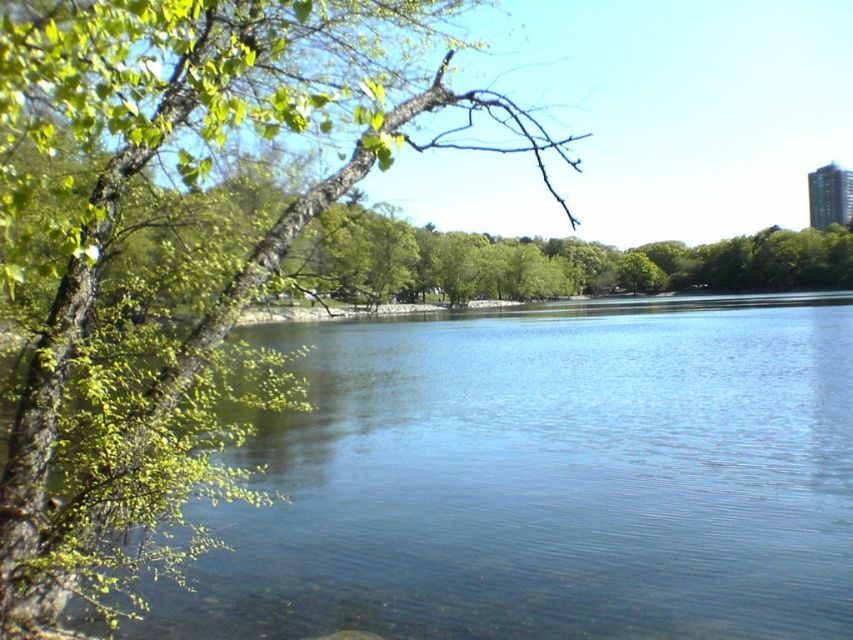
You are an artist wanting to paint the scene. You notice the clear blue water at left and the green leafy branch at left. Which one takes up more space in the image?

The green leafy branch at left takes up more space in the image because it is larger than the clear blue water at left.

You are standing at the edge of the scene and want to throw a stone into the clear blue water at left. To ensure the stone lands in the water and not on the green leafy branch at left, which object should you aim for based on their widths?

The clear blue water at left is wider than the green leafy branch at left, so you should aim for the clear blue water at left to ensure the stone lands in it.